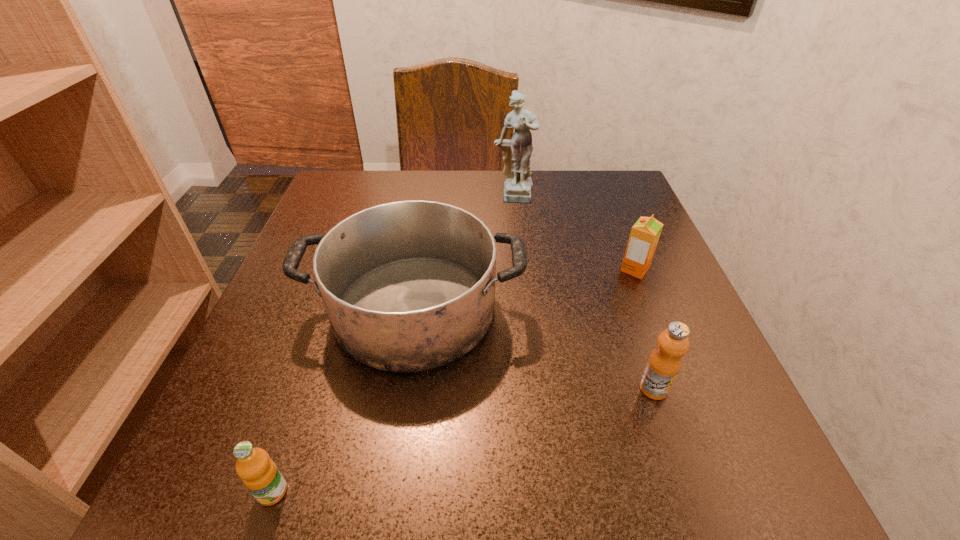
At what (x,y) coordinates should I click in order to perform the action: click on the third closest object to the figurine. Please return your answer as a coordinate pair (x, y). Image resolution: width=960 pixels, height=540 pixels. Looking at the image, I should click on (664, 363).

Identify which object is the nearest to the saucepan. Please provide its 2D coordinates. Your answer should be formatted as a tuple, i.e. [(x, y)], where the tuple contains the x and y coordinates of a point satisfying the conditions above.

[(259, 473)]

Identify the location of the third closest orange juice relative to the figurine. (259, 473).

Select which orange juice appears as the second closest to the saucepan. Please provide its 2D coordinates. Your answer should be formatted as a tuple, i.e. [(x, y)], where the tuple contains the x and y coordinates of a point satisfying the conditions above.

[(664, 363)]

This screenshot has height=540, width=960. I want to click on vacant position in the image that satisfies the following two spatial constraints: 1. on the front-facing side of the farthest orange juice; 2. on the right side of the figurine, so click(x=519, y=269).

Identify the location of free location that satisfies the following two spatial constraints: 1. on the front-facing side of the figurine; 2. on the right side of the farthest orange juice. This screenshot has width=960, height=540. (519, 269).